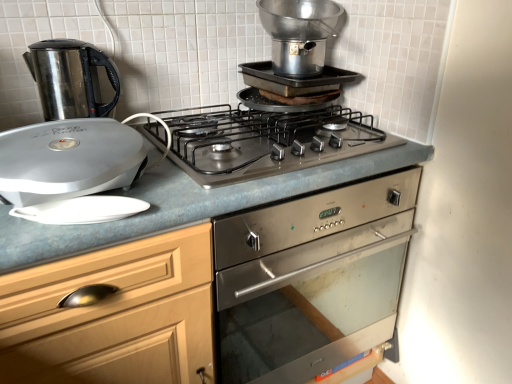
Question: Is metallic silver pot at upper center, marked as the third kitchen appliance in a left-to-right arrangement, positioned far away from blue laminate countertop at center?

Choices:
 (A) no
 (B) yes

Answer: (A)

Question: Can you see metallic silver pot at upper center, marked as the third kitchen appliance in a left-to-right arrangement, touching blue laminate countertop at center?

Choices:
 (A) yes
 (B) no

Answer: (B)

Question: Is metallic silver pot at upper center, which appears as the 1th kitchen appliance when viewed from the right, further to camera compared to blue laminate countertop at center?

Choices:
 (A) no
 (B) yes

Answer: (B)

Question: From the image's perspective, is metallic silver pot at upper center, which appears as the 1th kitchen appliance when viewed from the right, on blue laminate countertop at center?

Choices:
 (A) yes
 (B) no

Answer: (A)

Question: Can we say metallic silver pot at upper center, marked as the third kitchen appliance in a left-to-right arrangement, lies outside blue laminate countertop at center?

Choices:
 (A) no
 (B) yes

Answer: (B)

Question: Is blue laminate countertop at center located within metallic silver pot at upper center, which appears as the 1th kitchen appliance when viewed from the right?

Choices:
 (A) yes
 (B) no

Answer: (B)

Question: Is silver metallic george foreman grill at left, acting as the 2th kitchen appliance starting from the left, closer to camera compared to stainless steel kettle at left, which is counted as the 1th kitchen appliance, starting from the left?

Choices:
 (A) no
 (B) yes

Answer: (B)

Question: From a real-world perspective, is silver metallic george foreman grill at left, acting as the 2th kitchen appliance starting from the left, physically above stainless steel kettle at left, which is counted as the 1th kitchen appliance, starting from the left?

Choices:
 (A) no
 (B) yes

Answer: (A)

Question: Considering the relative sizes of silver metallic george foreman grill at left, acting as the 2th kitchen appliance starting from the left, and stainless steel kettle at left, acting as the third kitchen appliance starting from the right, in the image provided, is silver metallic george foreman grill at left, acting as the 2th kitchen appliance starting from the left, taller than stainless steel kettle at left, acting as the third kitchen appliance starting from the right,?

Choices:
 (A) no
 (B) yes

Answer: (A)

Question: From the image's perspective, is silver metallic george foreman grill at left, the 2th kitchen appliance positioned from the right, below stainless steel kettle at left, acting as the third kitchen appliance starting from the right?

Choices:
 (A) no
 (B) yes

Answer: (B)

Question: Can you confirm if silver metallic george foreman grill at left, acting as the 2th kitchen appliance starting from the left, is shorter than stainless steel kettle at left, which is counted as the 1th kitchen appliance, starting from the left?

Choices:
 (A) yes
 (B) no

Answer: (A)

Question: Is silver metallic george foreman grill at left, the 2th kitchen appliance positioned from the right, positioned beyond the bounds of stainless steel kettle at left, acting as the third kitchen appliance starting from the right?

Choices:
 (A) yes
 (B) no

Answer: (A)

Question: Is metallic silver pot at upper center, marked as the third kitchen appliance in a left-to-right arrangement, smaller than silver metallic george foreman grill at left, acting as the 2th kitchen appliance starting from the left?

Choices:
 (A) no
 (B) yes

Answer: (A)